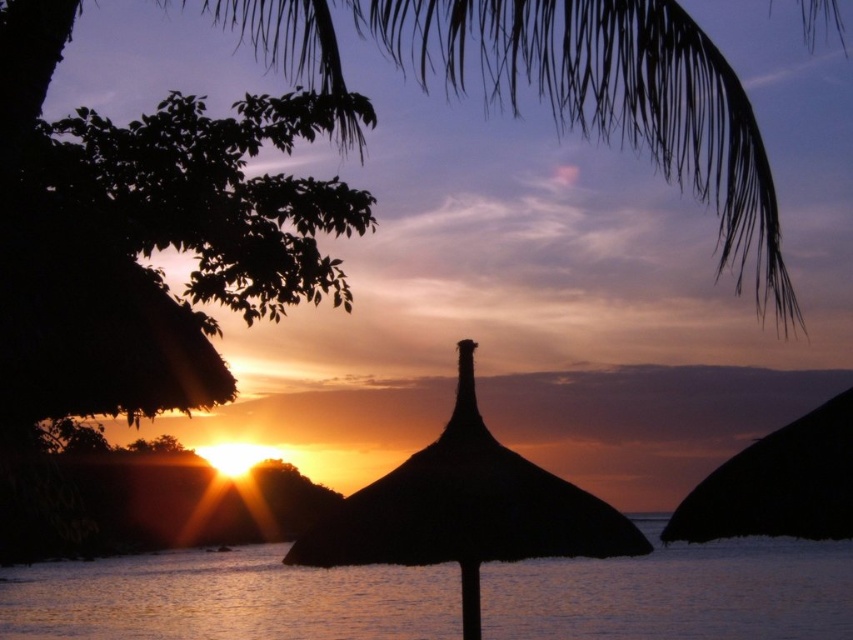
Question: Which point appears farthest from the camera in this image?

Choices:
 (A) (236, 561)
 (B) (459, 435)

Answer: (A)

Question: Observing the image, what is the correct spatial positioning of glistening water at center in reference to black straw umbrella at center?

Choices:
 (A) right
 (B) left

Answer: (B)

Question: Can you confirm if glistening water at center is positioned to the right of black straw umbrella at center?

Choices:
 (A) no
 (B) yes

Answer: (A)

Question: Can you confirm if glistening water at center is positioned to the right of black straw umbrella at center?

Choices:
 (A) yes
 (B) no

Answer: (B)